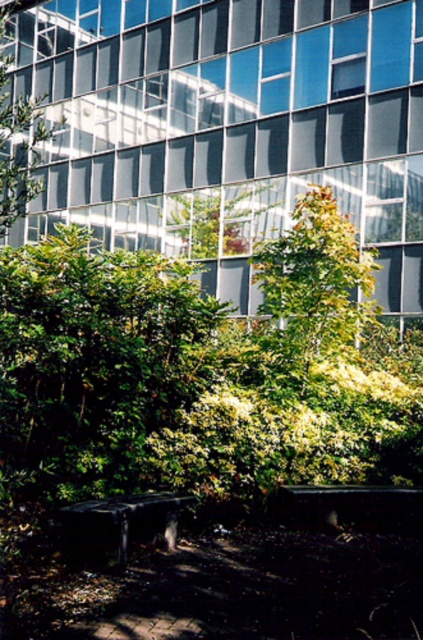
You are standing at point (x=312, y=289) in the image. What object is located exactly at your current position?

The green leafy tree at center is located exactly at point (x=312, y=289).

You are planning to host a small gathering in the park and need seating for 6 people. You see two benches in the image, the dark brown wooden bench at lower center and the dark gray concrete bench at lower center. Which bench can accommodate more people?

The dark brown wooden bench at lower center is larger in size than the dark gray concrete bench at lower center, so it can accommodate more people.

You are sitting on the dark brown wooden bench at lower center and want to look at the green leafy tree at center. In which direction should you turn your head?

You should turn your head to the right because the green leafy tree at center is located to the right of the dark brown wooden bench at lower center.